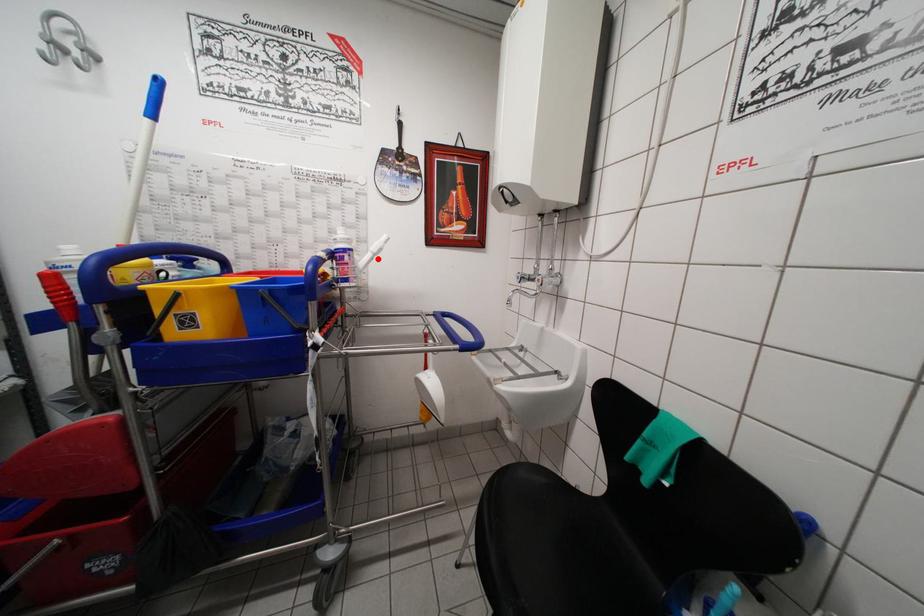
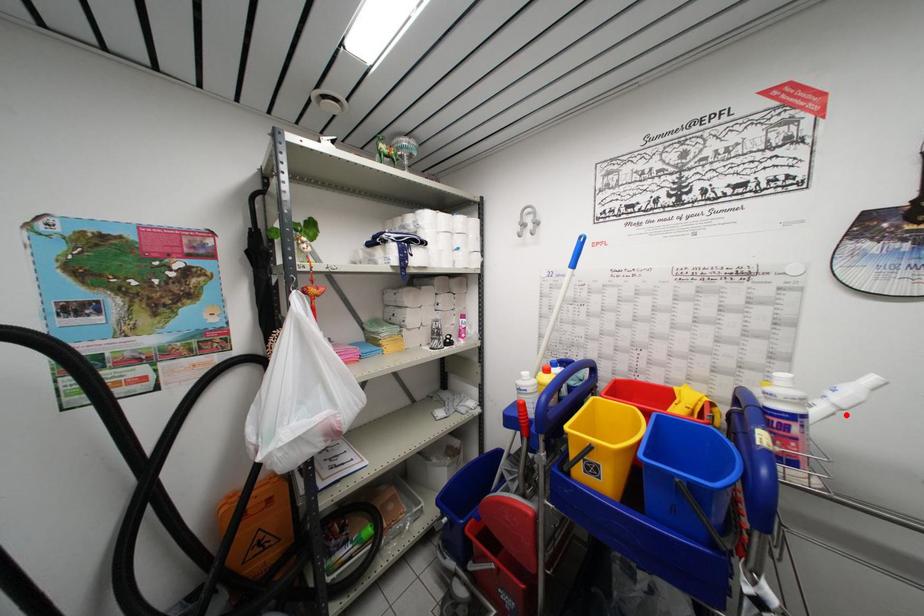
I am providing you with two images of the same scene from different viewpoints. A red point is marked on the first image and another point is marked on the second image. Is the red point in image1 aligned with the point shown in image2?

Yes